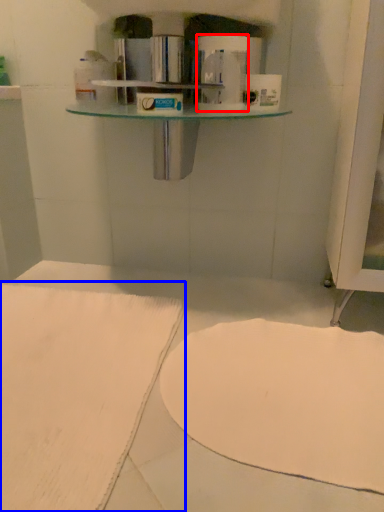
Question: Which of the following is the farthest to the observer, toilet paper (highlighted by a red box) or sheet (highlighted by a blue box)?

Choices:
 (A) toilet paper
 (B) sheet

Answer: (A)